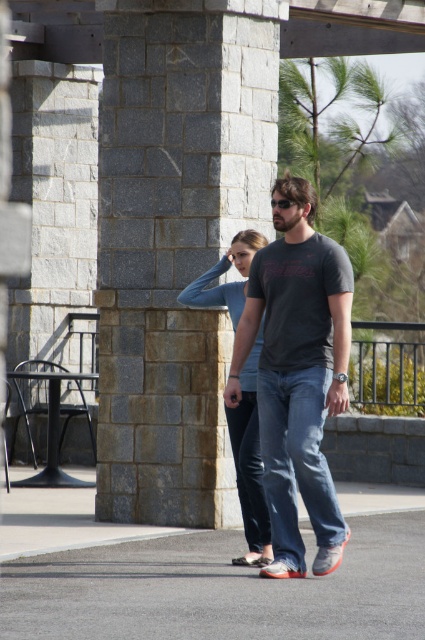
Question: Which object appears farthest from the camera in this image?

Choices:
 (A) gray asphalt at lower center
 (B) light blue denim jeans at center
 (C) gray stone pillar at center
 (D) dark gray t-shirt at center

Answer: (C)

Question: Does denim at center lie in front of light blue denim jeans at center?

Choices:
 (A) yes
 (B) no

Answer: (A)

Question: Is gray asphalt at lower center smaller than light blue denim jeans at center?

Choices:
 (A) yes
 (B) no

Answer: (A)

Question: Which object is positioned farthest from the dark gray t-shirt at center?

Choices:
 (A) light blue denim jeans at center
 (B) gray stone pillar at center
 (C) denim at center

Answer: (B)

Question: Considering the real-world distances, which object is farthest from the dark gray t-shirt at center?

Choices:
 (A) denim at center
 (B) gray stone pillar at center
 (C) gray asphalt at lower center

Answer: (B)

Question: Does gray stone pillar at center appear on the left side of dark gray t-shirt at center?

Choices:
 (A) no
 (B) yes

Answer: (B)